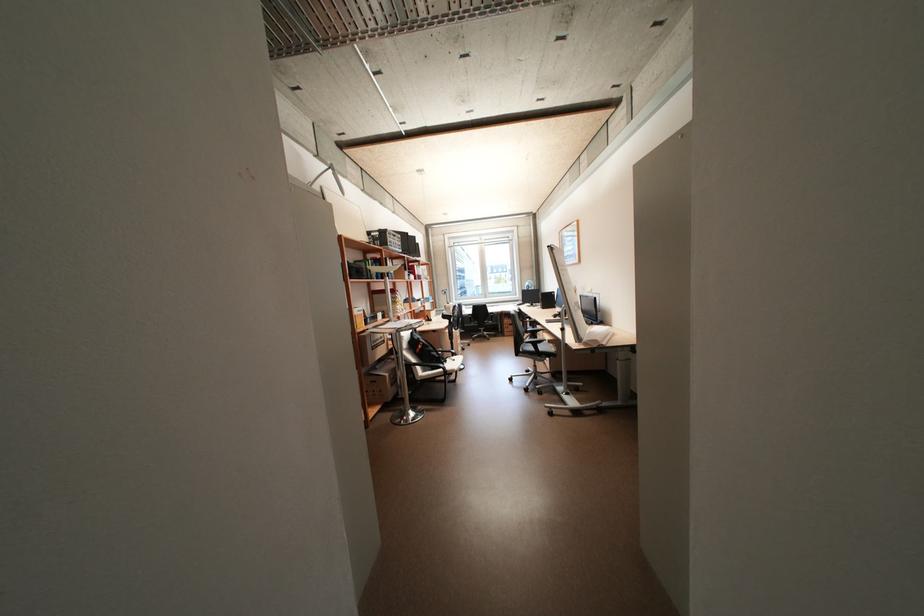
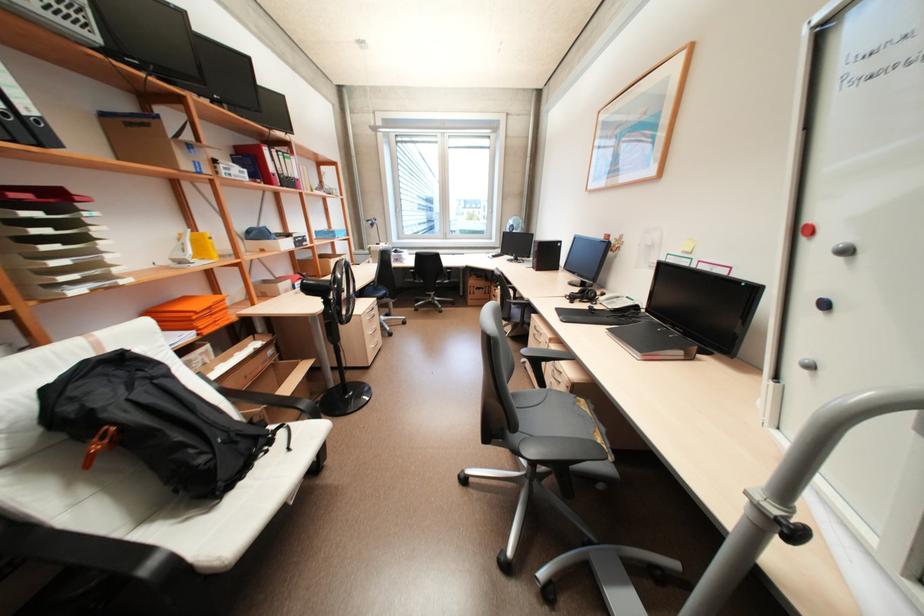
Question: The images are taken continuously from a first-person perspective. In which direction are you moving?

Choices:
 (A) Left
 (B) Right
 (C) Forward
 (D) Backward

Answer: (C)